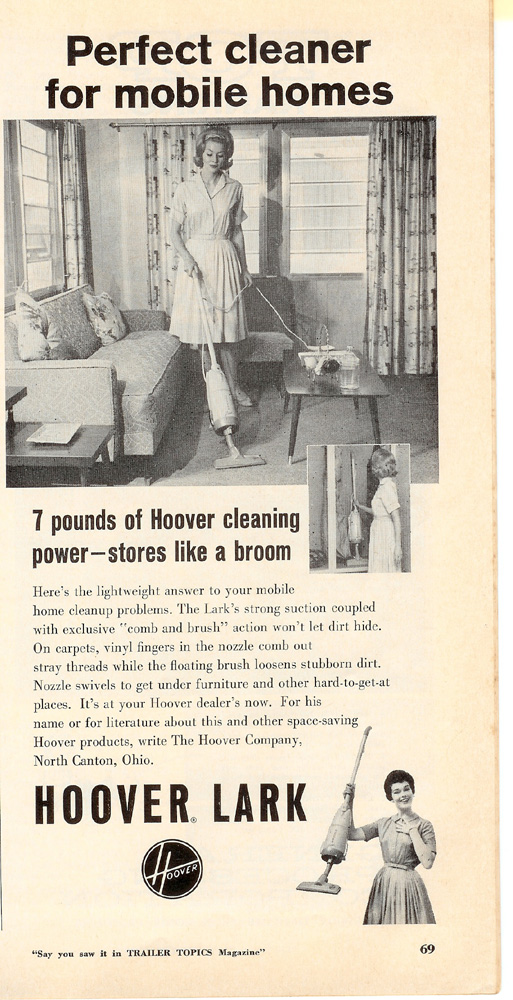
Find the location of `windows`. windows is located at coordinates (36, 194), (242, 145), (313, 181).